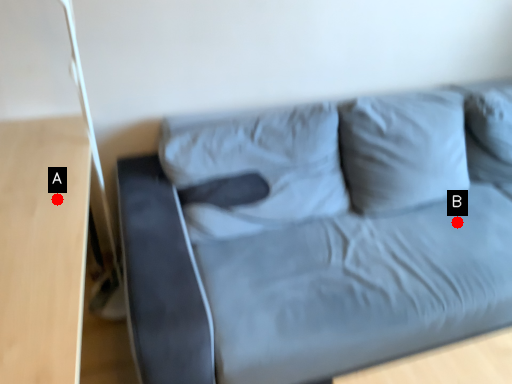
Question: Two points are circled on the image, labeled by A and B beside each circle. Which point appears closest to the camera in this image?

Choices:
 (A) A is closer
 (B) B is closer

Answer: (A)